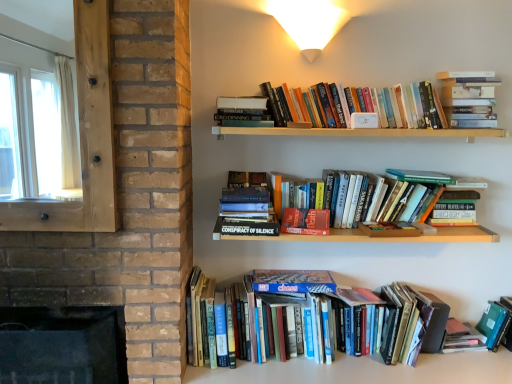
Question: Does hardcover book at lower right, which appears as the 1th paperback book when ordered from the bottom, have a greater height compared to hardcover books at upper right, the 5th book positioned from the bottom?

Choices:
 (A) no
 (B) yes

Answer: (A)

Question: Is hardcover book at lower right, which ranks as the 1th paperback book in right-to-left order, positioned beyond the bounds of hardcover books at upper right, the 5th book positioned from the bottom?

Choices:
 (A) yes
 (B) no

Answer: (A)

Question: Is hardcover book at lower right, which appears as the 1th paperback book when ordered from the bottom, positioned with its back to hardcover books at upper right, the 5th book positioned from the bottom?

Choices:
 (A) no
 (B) yes

Answer: (A)

Question: Is hardcover book at lower right, which ranks as the 3th paperback book in left-to-right order, touching hardcover books at upper right, the first book from the top?

Choices:
 (A) yes
 (B) no

Answer: (B)

Question: Does hardcover book at lower right, which ranks as the 1th paperback book in right-to-left order, turn towards hardcover books at upper right, the 5th book positioned from the bottom?

Choices:
 (A) no
 (B) yes

Answer: (A)

Question: From a real-world perspective, does hardcover book at lower right, which ranks as the 1th paperback book in right-to-left order, stand above hardcover books at upper right, the 5th book positioned from the bottom?

Choices:
 (A) no
 (B) yes

Answer: (A)

Question: From the image's perspective, does white matte wall sconce at upper center appear lower than transparent wooden frame at left?

Choices:
 (A) no
 (B) yes

Answer: (A)

Question: Are white matte wall sconce at upper center and transparent wooden frame at left far apart?

Choices:
 (A) no
 (B) yes

Answer: (A)

Question: Is white matte wall sconce at upper center in contact with transparent wooden frame at left?

Choices:
 (A) yes
 (B) no

Answer: (B)

Question: Is white matte wall sconce at upper center not inside transparent wooden frame at left?

Choices:
 (A) no
 (B) yes

Answer: (B)

Question: Does white matte wall sconce at upper center appear on the right side of transparent wooden frame at left?

Choices:
 (A) no
 (B) yes

Answer: (B)

Question: From a real-world perspective, is white matte wall sconce at upper center positioned under transparent wooden frame at left based on gravity?

Choices:
 (A) no
 (B) yes

Answer: (A)

Question: From a real-world perspective, is white matte wall sconce at upper center on top of hardcover books at upper right, the 5th book positioned from the bottom?

Choices:
 (A) yes
 (B) no

Answer: (A)